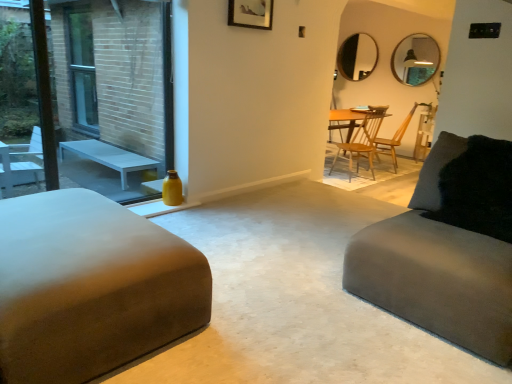
Question: Is wooden chair at center, which ranks as the first chair in right-to-left order, spatially inside black fuzzy pillow at right, or outside of it?

Choices:
 (A) inside
 (B) outside

Answer: (B)

Question: Considering the positions of wooden chair at center, which ranks as the first chair in right-to-left order, and black fuzzy pillow at right in the image, is wooden chair at center, which ranks as the first chair in right-to-left order, taller or shorter than black fuzzy pillow at right?

Choices:
 (A) tall
 (B) short

Answer: (A)

Question: Based on their relative distances, which object is farther from the matte black mirror at upper center, arranged as the 1th mirror when viewed from the left?

Choices:
 (A) matte silver picture frame at upper center
 (B) suede gray couch at right, the 1th studio couch from the right
 (C) yellow glass bottle at left
 (D) suede-like beige ottoman at left, marked as the first studio couch in a left-to-right arrangement
 (E) matte black mirror at upper right, the first mirror from the front

Answer: (D)

Question: Which object is positioned farthest from the wooden chair at center, which is counted as the 2th chair, starting from the left?

Choices:
 (A) matte black mirror at upper right, the first mirror from the front
 (B) suede gray couch at right, marked as the 2th studio couch in a left-to-right arrangement
 (C) matte silver picture frame at upper center
 (D) matte black mirror at upper center, the 2th mirror from the front
 (E) yellow glass bottle at left

Answer: (B)